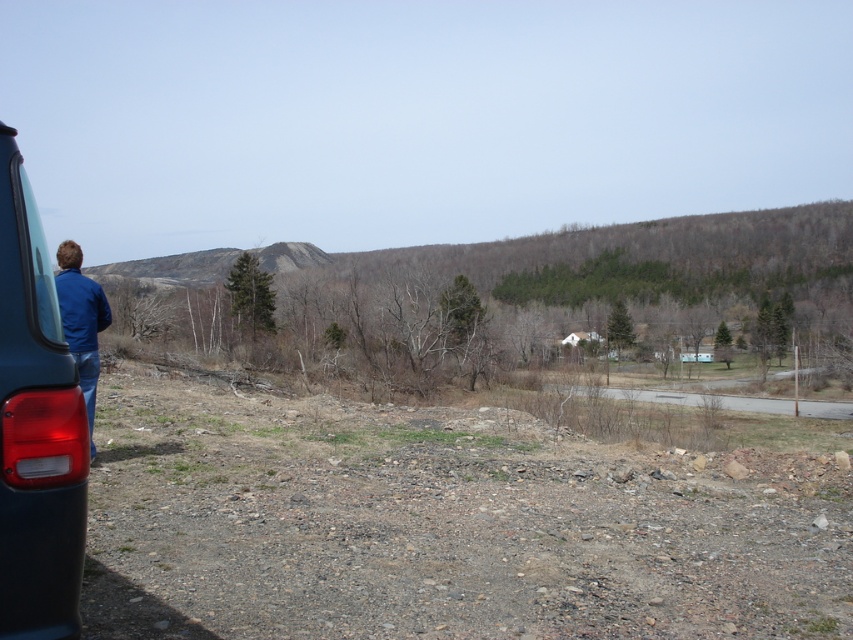
Question: Which of the following is the closest to the observer?

Choices:
 (A) (27, 536)
 (B) (88, 397)

Answer: (A)

Question: Does matte black car at left have a larger size compared to blue denim jacket at left?

Choices:
 (A) no
 (B) yes

Answer: (A)

Question: Can you confirm if matte black car at left is wider than blue denim jacket at left?

Choices:
 (A) no
 (B) yes

Answer: (A)

Question: Is matte black car at left to the left of blue denim jacket at left from the viewer's perspective?

Choices:
 (A) yes
 (B) no

Answer: (B)

Question: Which point is closer to the camera?

Choices:
 (A) blue denim jacket at left
 (B) matte black car at left

Answer: (B)

Question: Among these objects, which one is nearest to the camera?

Choices:
 (A) matte black car at left
 (B) blue denim jacket at left

Answer: (A)